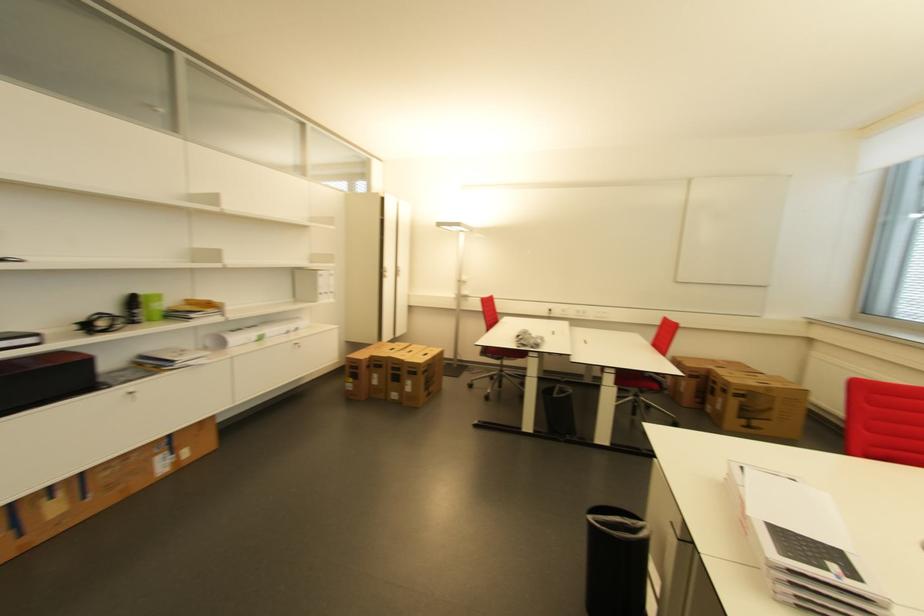
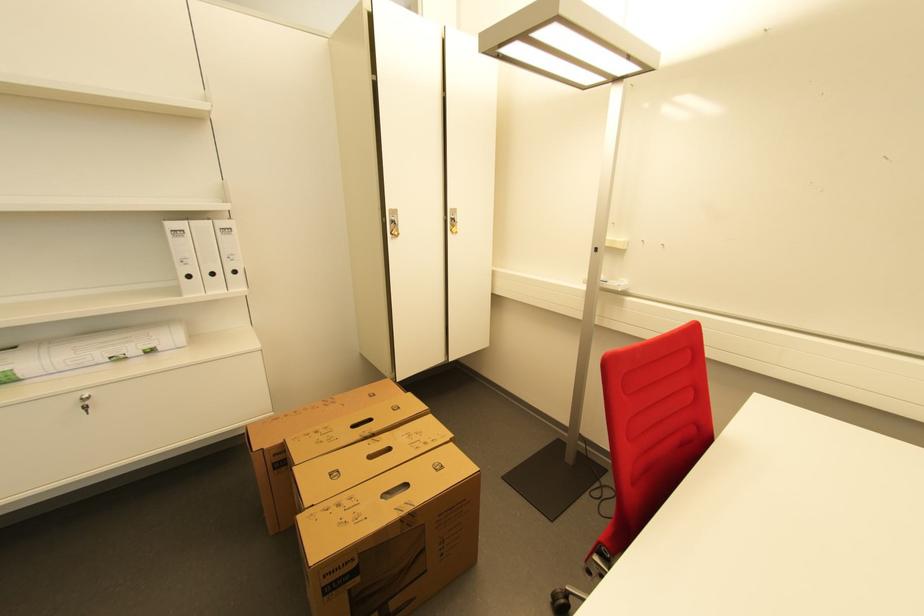
Locate, in the second image, the point that corresponds to (302,330) in the first image.

(155, 352)